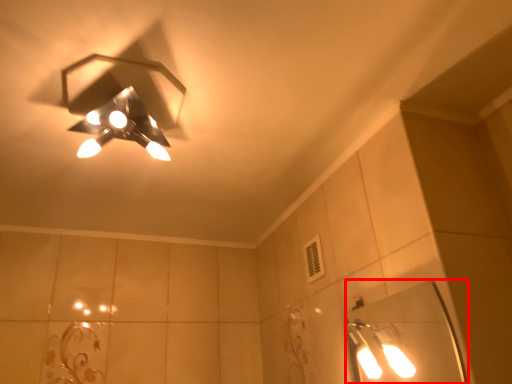
Question: Considering the relative positions of mirror (annotated by the red box) and lamp in the image provided, where is mirror (annotated by the red box) located with respect to the staircase?

Choices:
 (A) left
 (B) right

Answer: (B)